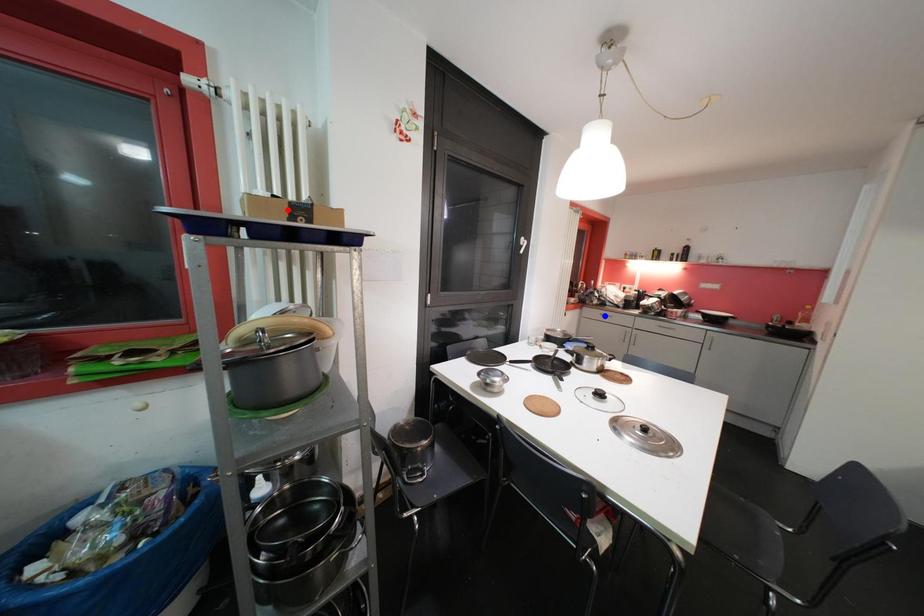
Question: Two points are marked on the image. Which point is closer to the camera?

Choices:
 (A) Blue point is closer.
 (B) Red point is closer.

Answer: (B)